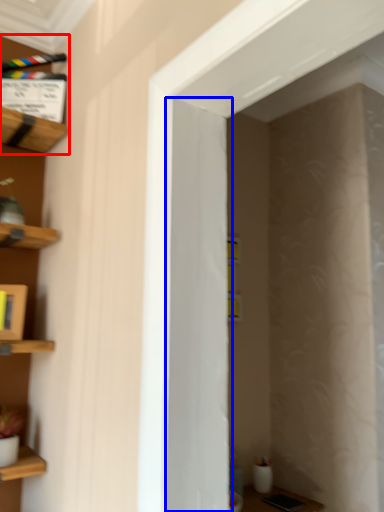
Question: Which point is closer to the camera, shelf (highlighted by a red box) or door (highlighted by a blue box)?

Choices:
 (A) shelf
 (B) door

Answer: (B)